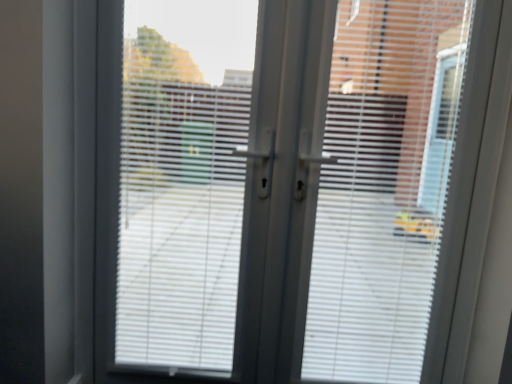
Question: Should I look upward or downward to see white matte blinds at center?

Choices:
 (A) down
 (B) up

Answer: (A)

Question: Is white plastic window screen at center thinner than white matte blinds at center?

Choices:
 (A) no
 (B) yes

Answer: (B)

Question: Is white plastic window screen at center positioned behind white matte blinds at center?

Choices:
 (A) yes
 (B) no

Answer: (A)

Question: Considering the relative sizes of white plastic window screen at center and white matte blinds at center in the image provided, is white plastic window screen at center wider than white matte blinds at center?

Choices:
 (A) yes
 (B) no

Answer: (B)

Question: Can you confirm if white plastic window screen at center is positioned to the left of white matte blinds at center?

Choices:
 (A) yes
 (B) no

Answer: (A)

Question: From the image's perspective, is white plastic window screen at center beneath white matte blinds at center?

Choices:
 (A) yes
 (B) no

Answer: (B)

Question: Could you tell me if white plastic window screen at center is facing white matte blinds at center?

Choices:
 (A) no
 (B) yes

Answer: (A)

Question: Is the depth of white matte blinds at center greater than that of white plastic window screen at center?

Choices:
 (A) no
 (B) yes

Answer: (A)

Question: Is the position of white matte blinds at center less distant than that of white plastic window screen at center?

Choices:
 (A) no
 (B) yes

Answer: (B)

Question: Considering the relative sizes of white matte blinds at center and white plastic window screen at center in the image provided, is white matte blinds at center shorter than white plastic window screen at center?

Choices:
 (A) no
 (B) yes

Answer: (A)

Question: Is white matte blinds at center to the left of white plastic window screen at center from the viewer's perspective?

Choices:
 (A) yes
 (B) no

Answer: (B)

Question: Is white matte blinds at center not near white plastic window screen at center?

Choices:
 (A) no
 (B) yes

Answer: (A)

Question: Is white matte blinds at center in contact with white plastic window screen at center?

Choices:
 (A) no
 (B) yes

Answer: (A)

Question: Would you say white plastic window screen at center is inside or outside white matte blinds at center?

Choices:
 (A) inside
 (B) outside

Answer: (B)